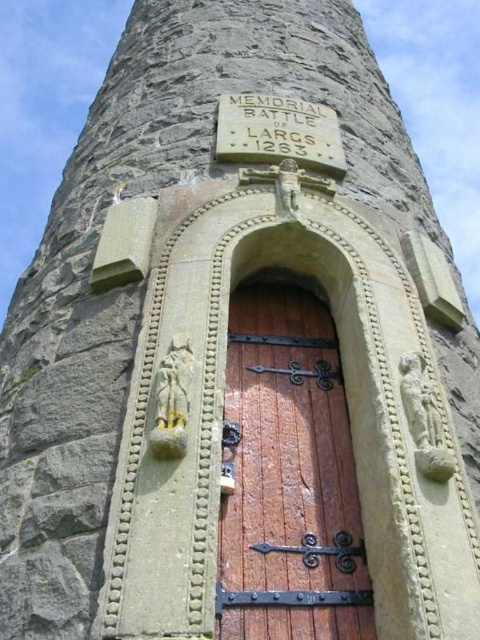
Is wooden door at center to the left of stone plaque at center from the viewer's perspective?

No, wooden door at center is not to the left of stone plaque at center.

Between point (303, 344) and point (278, 122), which one is positioned in front?

Point (303, 344) is in front.

What are the coordinates of `wooden door at center` in the screenshot? It's located at (288, 476).